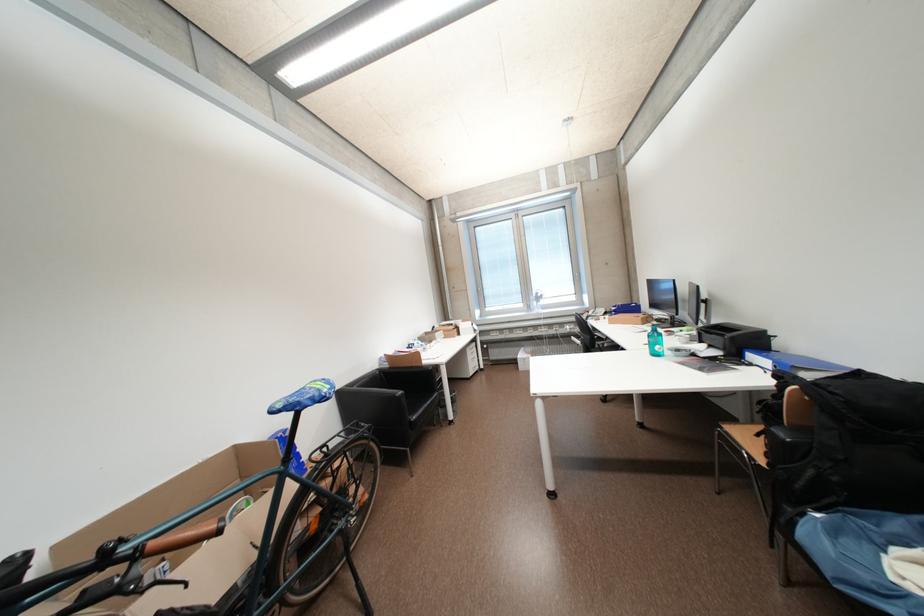
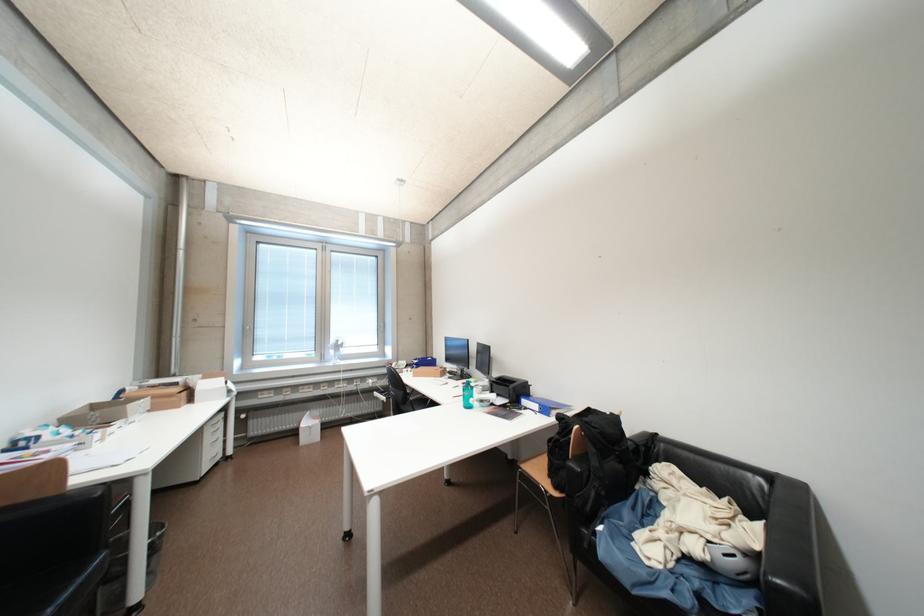
Locate, in the second image, the point that corresponds to the point at 477,354 in the first image.

(216, 432)